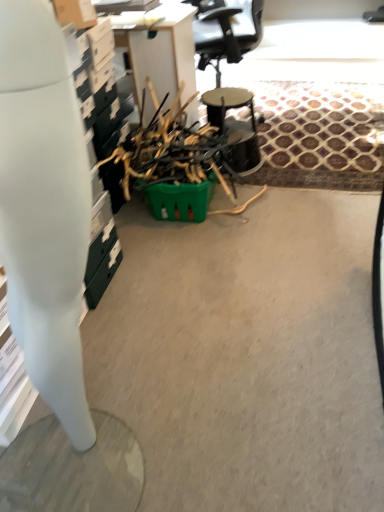
Question: Is green plastic basket at center to the left or to the right of white glossy desk at left in the image?

Choices:
 (A) right
 (B) left

Answer: (A)

Question: From the image's perspective, is green plastic basket at center above or below white glossy desk at left?

Choices:
 (A) above
 (B) below

Answer: (A)

Question: Which of these objects is positioned closest to the green plastic basket at center?

Choices:
 (A) white glossy desk at left
 (B) metallic black drum at center

Answer: (B)

Question: Estimate the real-world distances between objects in this image. Which object is closer to the white glossy desk at left?

Choices:
 (A) green plastic basket at center
 (B) metallic black drum at center

Answer: (A)